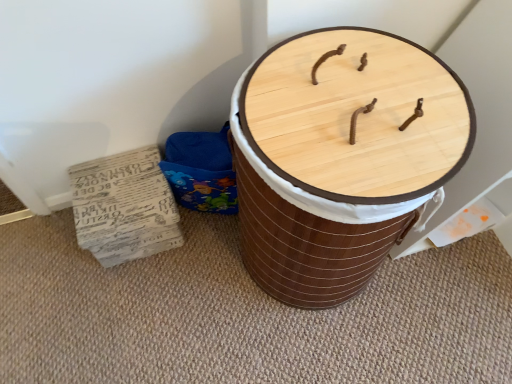
Question: Considering the relative sizes of wooden barrel at center and recycled paper stack at lower left in the image provided, is wooden barrel at center taller than recycled paper stack at lower left?

Choices:
 (A) yes
 (B) no

Answer: (A)

Question: From the image's perspective, is wooden barrel at center below recycled paper stack at lower left?

Choices:
 (A) yes
 (B) no

Answer: (B)

Question: Is the position of wooden barrel at center more distant than that of recycled paper stack at lower left?

Choices:
 (A) no
 (B) yes

Answer: (A)

Question: Is wooden barrel at center located outside recycled paper stack at lower left?

Choices:
 (A) no
 (B) yes

Answer: (B)

Question: From a real-world perspective, is wooden barrel at center on top of recycled paper stack at lower left?

Choices:
 (A) yes
 (B) no

Answer: (A)

Question: Can you confirm if wooden barrel at center is shorter than recycled paper stack at lower left?

Choices:
 (A) no
 (B) yes

Answer: (A)

Question: Considering the relative sizes of recycled paper stack at lower left and wooden barrel at center in the image provided, is recycled paper stack at lower left taller than wooden barrel at center?

Choices:
 (A) yes
 (B) no

Answer: (B)

Question: Does recycled paper stack at lower left have a greater width compared to wooden barrel at center?

Choices:
 (A) yes
 (B) no

Answer: (B)

Question: Are recycled paper stack at lower left and wooden barrel at center beside each other?

Choices:
 (A) yes
 (B) no

Answer: (B)

Question: Considering the relative positions of recycled paper stack at lower left and wooden barrel at center in the image provided, is recycled paper stack at lower left to the right of wooden barrel at center from the viewer's perspective?

Choices:
 (A) no
 (B) yes

Answer: (A)

Question: Would you consider recycled paper stack at lower left to be distant from wooden barrel at center?

Choices:
 (A) no
 (B) yes

Answer: (A)

Question: Does recycled paper stack at lower left contain wooden barrel at center?

Choices:
 (A) yes
 (B) no

Answer: (B)

Question: Is point click(158, 153) closer or farther from the camera than point click(419, 137)?

Choices:
 (A) farther
 (B) closer

Answer: (A)